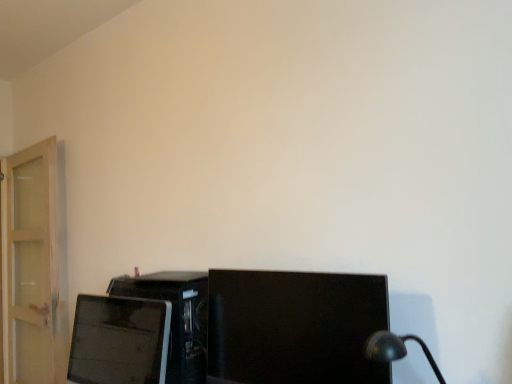
Question: Could matte black desktop computer at lower left be considered to be inside black glossy monitor at center, which appears as the first computer monitor when viewed from the right?

Choices:
 (A) no
 (B) yes

Answer: (A)

Question: Could you tell me if black glossy monitor at center, which appears as the first computer monitor when viewed from the right, is turned towards matte black desktop computer at lower left?

Choices:
 (A) yes
 (B) no

Answer: (B)

Question: Would you consider black glossy monitor at center, arranged as the 2th computer monitor when viewed from the left, to be distant from matte black desktop computer at lower left?

Choices:
 (A) no
 (B) yes

Answer: (A)

Question: Considering the relative sizes of black glossy monitor at center, which appears as the first computer monitor when viewed from the right, and matte black desktop computer at lower left in the image provided, is black glossy monitor at center, which appears as the first computer monitor when viewed from the right, smaller than matte black desktop computer at lower left?

Choices:
 (A) yes
 (B) no

Answer: (B)

Question: From a real-world perspective, is black glossy monitor at center, arranged as the 2th computer monitor when viewed from the left, positioned under matte black desktop computer at lower left based on gravity?

Choices:
 (A) yes
 (B) no

Answer: (B)

Question: Is black glossy monitor at center, which appears as the first computer monitor when viewed from the right, facing away from matte black desktop computer at lower left?

Choices:
 (A) yes
 (B) no

Answer: (B)

Question: From the image's perspective, is matte black monitor at lower left, which is counted as the 2th computer monitor, starting from the right, on black glossy monitor at center, which appears as the first computer monitor when viewed from the right?

Choices:
 (A) no
 (B) yes

Answer: (A)

Question: Is matte black monitor at lower left, marked as the 1th computer monitor in a left-to-right arrangement, aimed at black glossy monitor at center, which appears as the first computer monitor when viewed from the right?

Choices:
 (A) yes
 (B) no

Answer: (B)

Question: Considering the relative sizes of matte black monitor at lower left, marked as the 1th computer monitor in a left-to-right arrangement, and black glossy monitor at center, arranged as the 2th computer monitor when viewed from the left, in the image provided, is matte black monitor at lower left, marked as the 1th computer monitor in a left-to-right arrangement, shorter than black glossy monitor at center, arranged as the 2th computer monitor when viewed from the left,?

Choices:
 (A) no
 (B) yes

Answer: (B)

Question: Is matte black monitor at lower left, marked as the 1th computer monitor in a left-to-right arrangement, to the left of black glossy monitor at center, arranged as the 2th computer monitor when viewed from the left, from the viewer's perspective?

Choices:
 (A) yes
 (B) no

Answer: (A)

Question: Are matte black monitor at lower left, marked as the 1th computer monitor in a left-to-right arrangement, and black glossy monitor at center, arranged as the 2th computer monitor when viewed from the left, making contact?

Choices:
 (A) no
 (B) yes

Answer: (A)

Question: Is matte black monitor at lower left, which is counted as the 2th computer monitor, starting from the right, taller than black glossy monitor at center, which appears as the first computer monitor when viewed from the right?

Choices:
 (A) yes
 (B) no

Answer: (B)

Question: From the image's perspective, is matte black desktop computer at lower left below matte black monitor at lower left, which is counted as the 2th computer monitor, starting from the right?

Choices:
 (A) no
 (B) yes

Answer: (B)